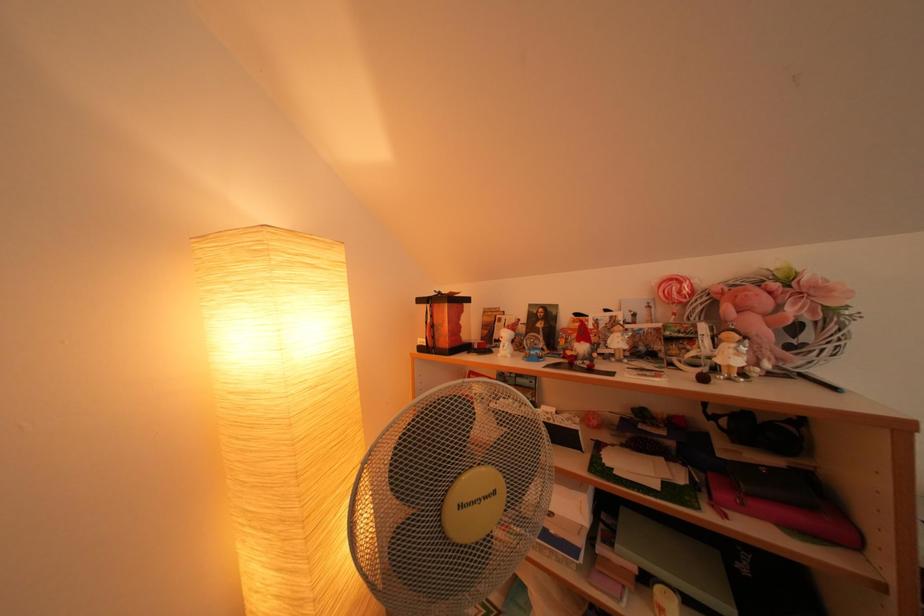
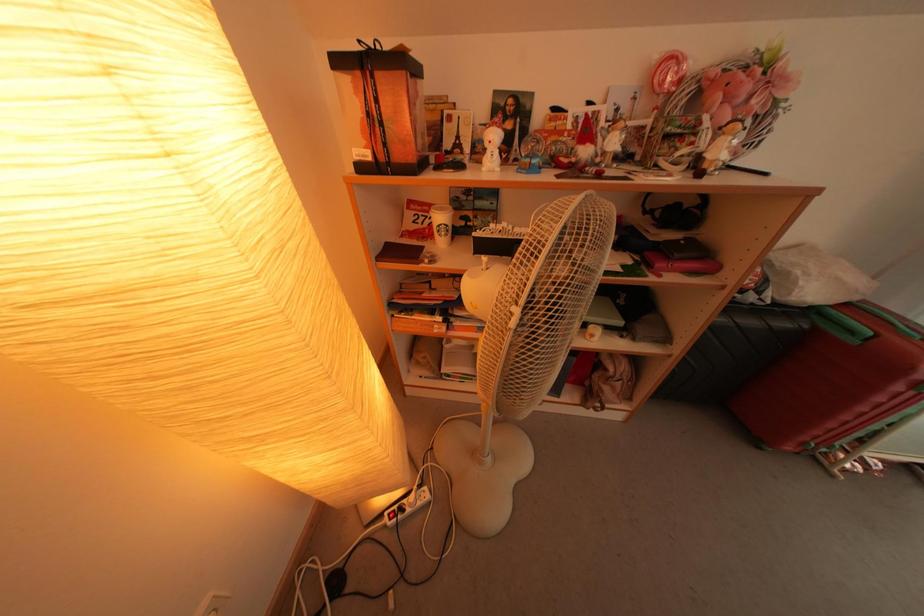
Based on the photo, the first image is from the beginning of the video and the second image is from the end. How did the camera likely rotate when shooting the video?

The camera rotated toward right-down.